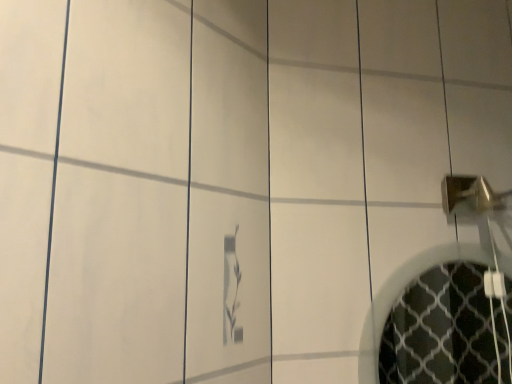
Measure the distance between matte glass window at right and camera.

matte glass window at right is 1.70 meters away from camera.

Locate an element on the screen. The height and width of the screenshot is (384, 512). matte glass window at right is located at coordinates (447, 330).

The image size is (512, 384). Describe the element at coordinates (447, 330) in the screenshot. I see `matte glass window at right` at that location.

Where is `matte glass window at right`? matte glass window at right is located at coordinates pos(447,330).